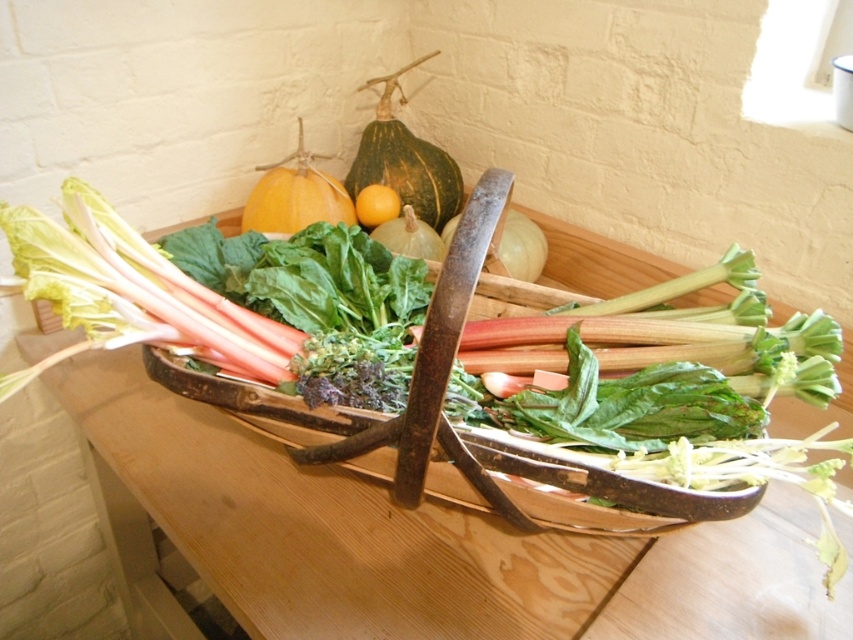
Is green textured squash at upper center above smooth orange squash at upper center?

Correct, green textured squash at upper center is located above smooth orange squash at upper center.

Which is more to the left, green textured squash at upper center or smooth orange squash at upper center?

smooth orange squash at upper center

Is point (349, 189) more distant than point (293, 205)?

Yes, point (349, 189) is behind point (293, 205).

Where is `green textured squash at upper center`? This screenshot has height=640, width=853. green textured squash at upper center is located at coordinates (404, 160).

Who is more distant from viewer, (601, 240) or (357, 200)?

The point (357, 200) is more distant.

Does point (618, 548) lie in front of point (381, 220)?

Yes, point (618, 548) is closer to viewer.

The width and height of the screenshot is (853, 640). Describe the element at coordinates (306, 532) in the screenshot. I see `wooden table at center` at that location.

Identify the location of wooden table at center. The height and width of the screenshot is (640, 853). (306, 532).

Is smooth orange squash at upper center below yellow smooth orange at center?

Incorrect, smooth orange squash at upper center is not positioned below yellow smooth orange at center.

Looking at this image, between smooth orange squash at upper center and yellow smooth orange at center, which one is positioned lower?

yellow smooth orange at center

Between point (268, 220) and point (375, 195), which one is positioned behind?

The point (375, 195) is behind.

Find the location of a particular element. The image size is (853, 640). smooth orange squash at upper center is located at coordinates (x=294, y=195).